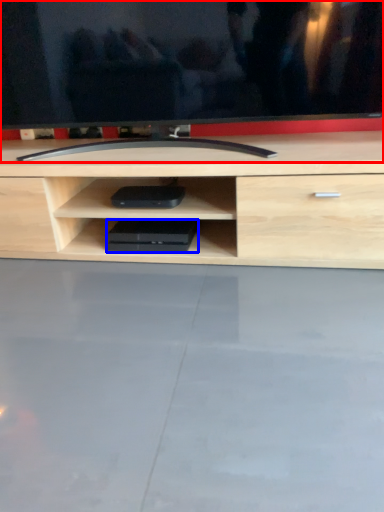
Question: Which of the following is the farthest to the observer, television (highlighted by a red box) or equipment (highlighted by a blue box)?

Choices:
 (A) television
 (B) equipment

Answer: (B)